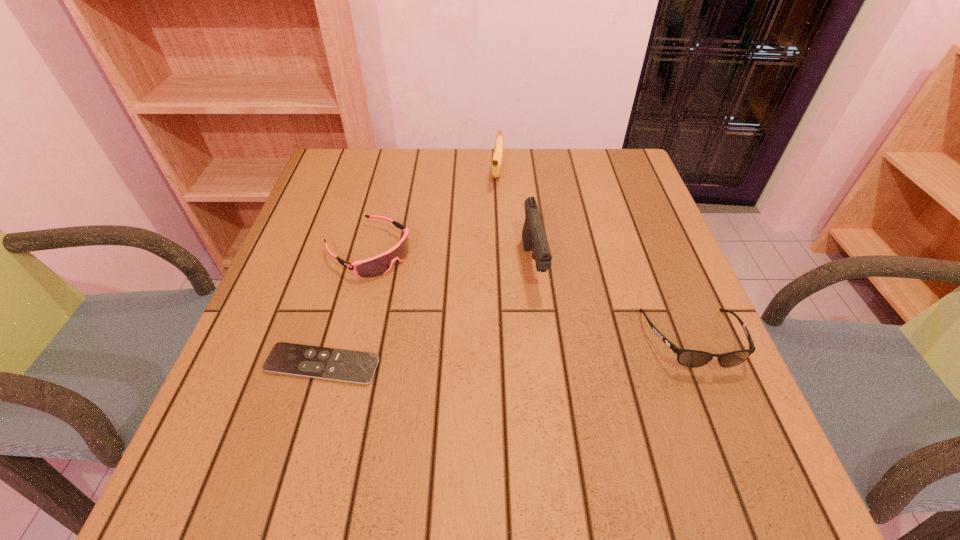
I want to click on goggles at the left edge, so click(378, 265).

The image size is (960, 540). Find the location of `object that is at the right edge`. object that is at the right edge is located at coordinates (688, 358).

This screenshot has width=960, height=540. I want to click on object at the near left corner, so click(x=356, y=367).

In order to click on vacant space at the far edge of the desktop in this screenshot , I will do pos(424,189).

Locate an element on the screen. This screenshot has height=540, width=960. free space at the left edge of the desktop is located at coordinates (331, 198).

Identify the location of free region at the right edge of the desktop. (610, 245).

Locate an element on the screen. vacant space at the far left corner of the desktop is located at coordinates (372, 186).

Where is `vacant space at the far right corner`? vacant space at the far right corner is located at coordinates (629, 168).

Locate an element on the screen. This screenshot has height=540, width=960. vacant area at the near right corner is located at coordinates [x=711, y=390].

Where is `vacant area that lies between the fourth object from left to right and the sunglasses`? The image size is (960, 540). vacant area that lies between the fourth object from left to right and the sunglasses is located at coordinates (612, 303).